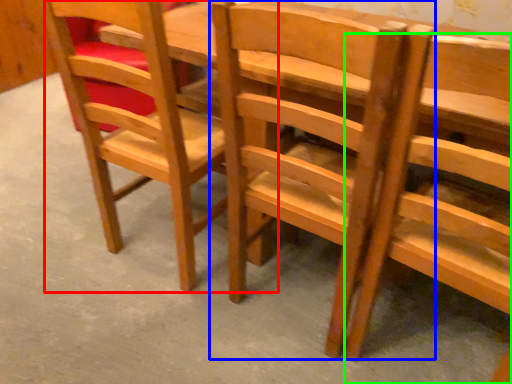
Question: Considering the real-world distances, which object is farthest from chair (highlighted by a red box)? chair (highlighted by a blue box) or chair (highlighted by a green box)?

Choices:
 (A) chair
 (B) chair

Answer: (B)